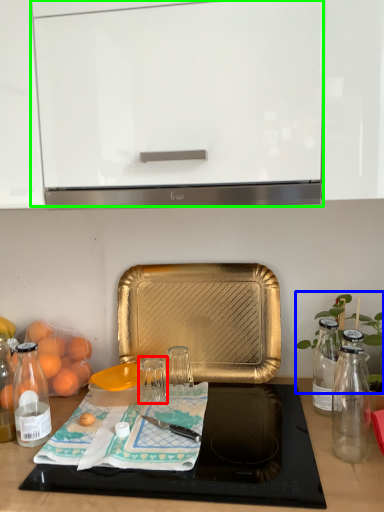
Question: Based on their relative distances, which object is nearer to glass jar (highlighted by a red box)? Choose from plant (highlighted by a blue box) and cabinetry (highlighted by a green box).

Choices:
 (A) plant
 (B) cabinetry

Answer: (A)